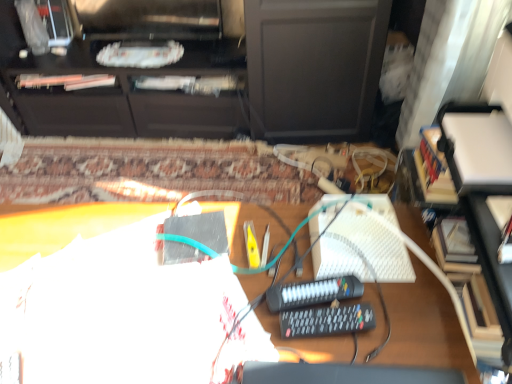
You are a GUI agent. You are given a task and a screenshot of the screen. Output one action in this format:
    pyautogui.click(x=<x>, y=<y>)
    Task: Click on the free region on the left part of black plastic remote control at center, arranged as the 1th equipment when viewed from the back
    Image resolution: width=512 pixels, height=384 pixels.
    Given the screenshot: What is the action you would take?
    pyautogui.click(x=231, y=310)